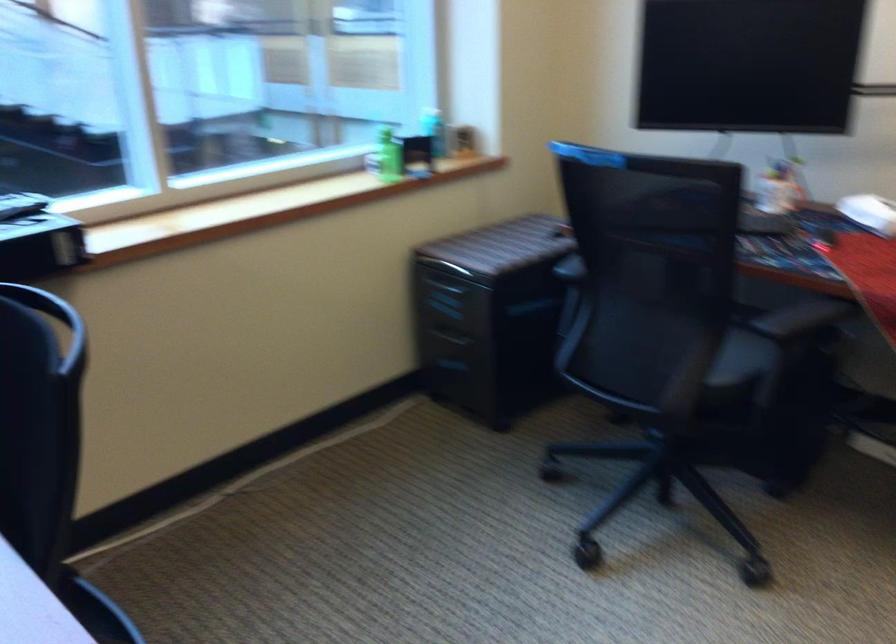
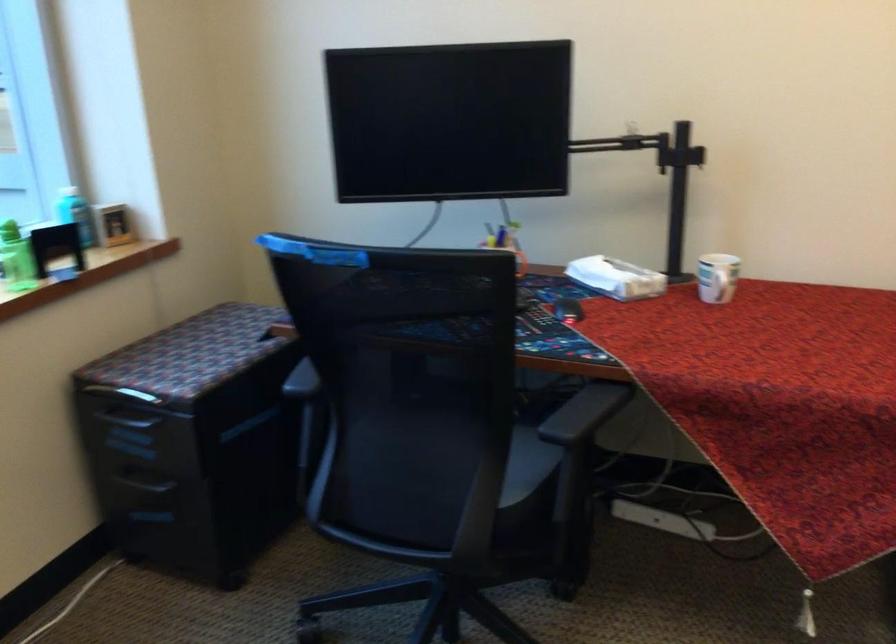
The point at (x=742, y=357) is marked in the first image. Where is the corresponding point in the second image?

(527, 465)